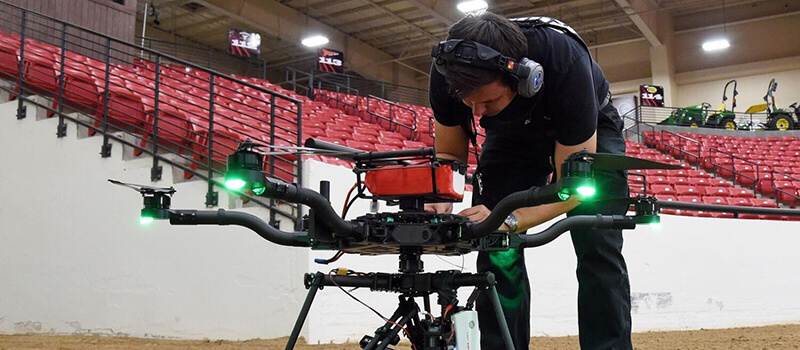
Locate an element on the screen. light is located at coordinates (262, 178).